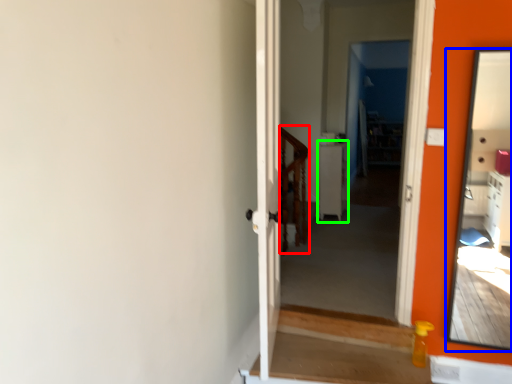
Question: Which object is the farthest from balustrade (highlighted by a red box)? Choose among these: mirror (highlighted by a blue box) or table (highlighted by a green box).

Choices:
 (A) mirror
 (B) table

Answer: (A)